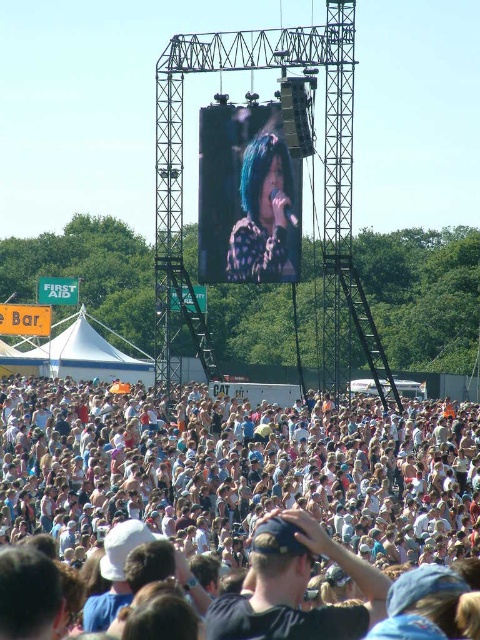
Question: Is white cotton crowd at lower center to the left of shiny purple hair at center from the viewer's perspective?

Choices:
 (A) no
 (B) yes

Answer: (B)

Question: Is white cotton crowd at lower center further to the viewer compared to shiny purple hair at center?

Choices:
 (A) no
 (B) yes

Answer: (A)

Question: Which object is closer to the camera taking this photo?

Choices:
 (A) white cotton crowd at lower center
 (B) shiny purple hair at center

Answer: (A)

Question: Which of the following is the closest to the observer?

Choices:
 (A) click(256, 451)
 (B) click(251, 173)

Answer: (A)

Question: Can you confirm if white cotton crowd at lower center is thinner than shiny purple hair at center?

Choices:
 (A) no
 (B) yes

Answer: (A)

Question: Which point is farther from the camera taking this photo?

Choices:
 (A) (145, 611)
 (B) (280, 244)

Answer: (B)